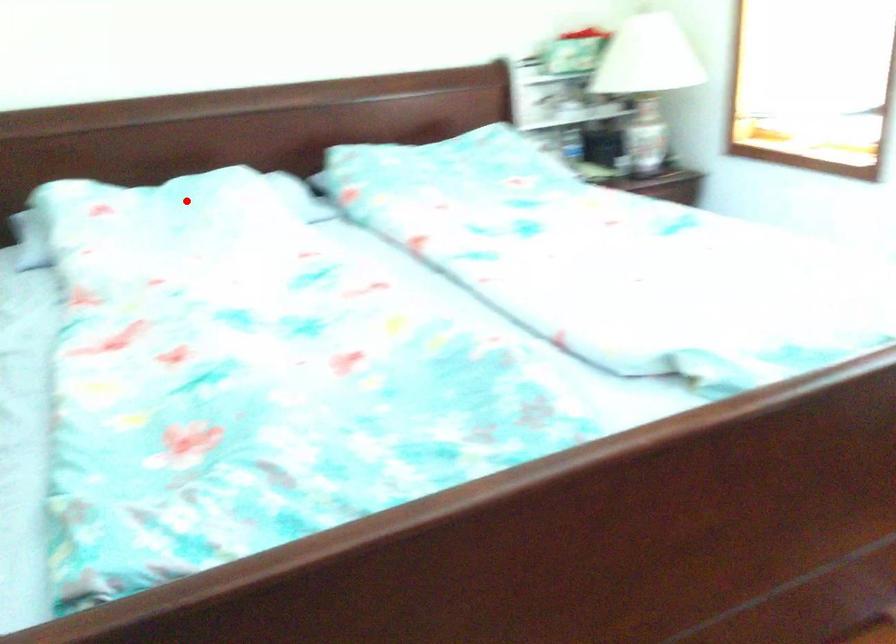
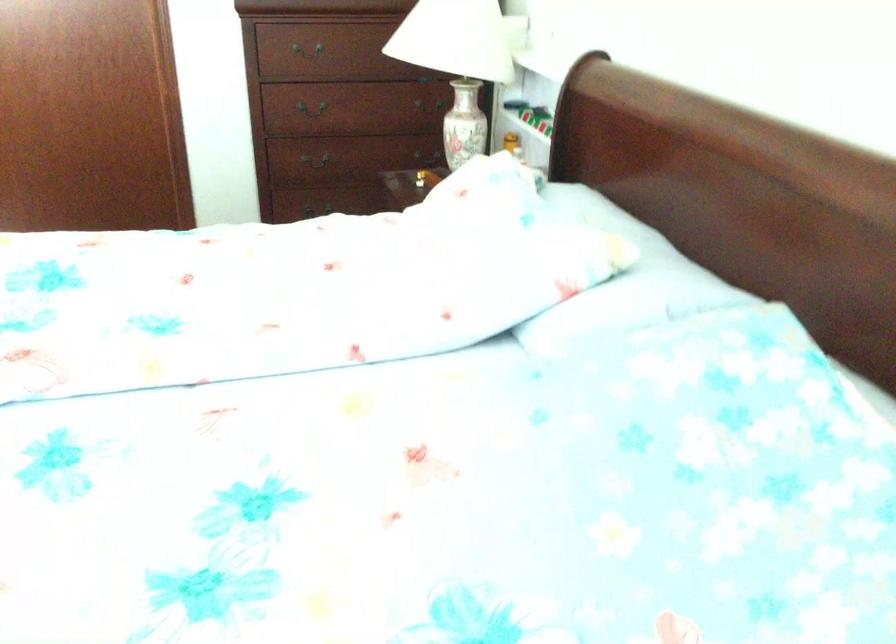
Question: I am providing you with two images of the same scene from different viewpoints. Image1 has a red point marked. In image2, the corresponding 3D location appears at what relative position? Reply with the corresponding letter.

Choices:
 (A) Closer
 (B) Farther

Answer: (A)